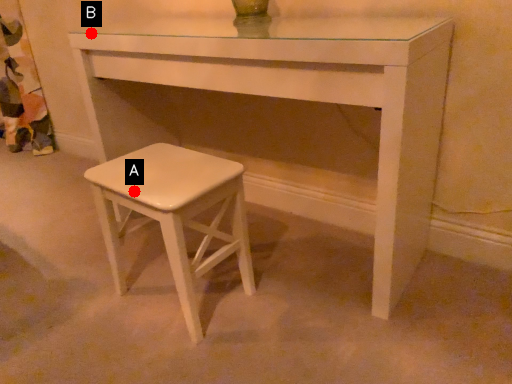
Question: Two points are circled on the image, labeled by A and B beside each circle. Which of the following is the closest to the observer?

Choices:
 (A) A is closer
 (B) B is closer

Answer: (A)